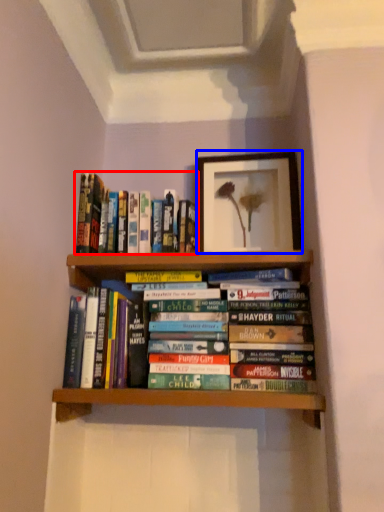
Question: Which of the following is the closest to the observer, book (highlighted by a red box) or picture frame (highlighted by a blue box)?

Choices:
 (A) book
 (B) picture frame

Answer: (A)